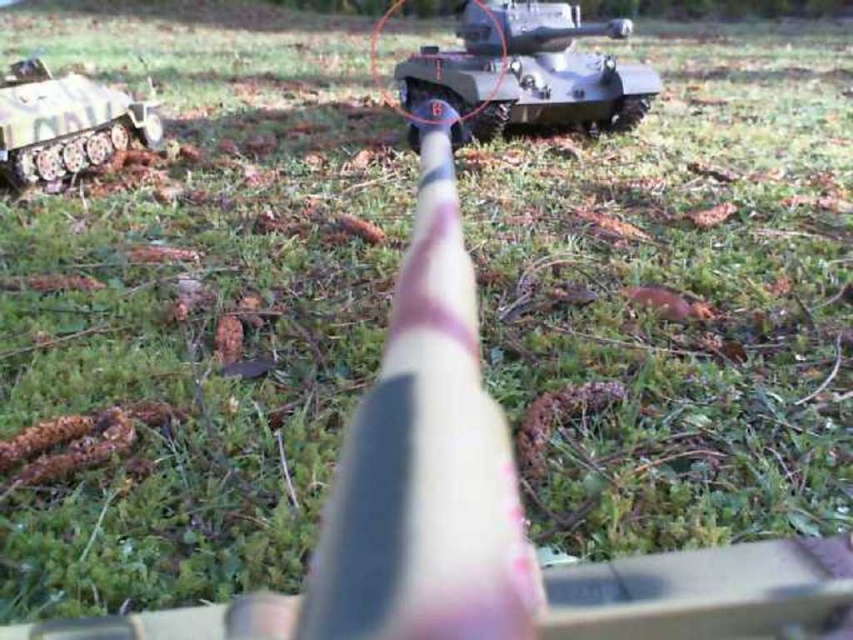
Is matte gray tank at center taller than camouflage paint tank at left?

Correct, matte gray tank at center is much taller as camouflage paint tank at left.

Is matte gray tank at center shorter than camouflage paint tank at left?

In fact, matte gray tank at center may be taller than camouflage paint tank at left.

This screenshot has height=640, width=853. What do you see at coordinates (527, 72) in the screenshot?
I see `matte gray tank at center` at bounding box center [527, 72].

Identify the location of matte gray tank at center. The height and width of the screenshot is (640, 853). (527, 72).